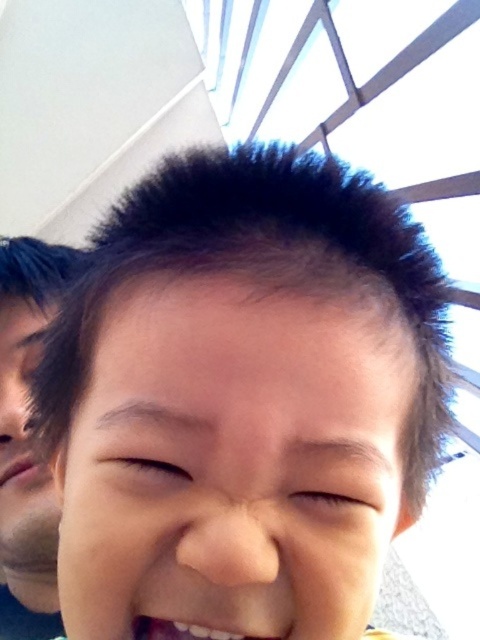
Question: Considering the relative positions of dark brown hair at center and pink matte lips at lower left in the image provided, where is dark brown hair at center located with respect to pink matte lips at lower left?

Choices:
 (A) below
 (B) above

Answer: (B)

Question: Among these points, which one is nearest to the camera?

Choices:
 (A) (7, 474)
 (B) (340, 536)
 (C) (27, 630)

Answer: (B)

Question: Is smooth skin mouth at center to the right of pink matte lips at lower left from the viewer's perspective?

Choices:
 (A) no
 (B) yes

Answer: (B)

Question: Is matte black hair at left positioned at the back of smooth skin mouth at center?

Choices:
 (A) yes
 (B) no

Answer: (A)

Question: Among these objects, which one is nearest to the camera?

Choices:
 (A) dark brown hair at center
 (B) matte black hair at left

Answer: (A)

Question: Which of the following is the farthest from the observer?

Choices:
 (A) (372, 504)
 (B) (17, 461)
 (C) (166, 637)
 (D) (43, 564)

Answer: (D)